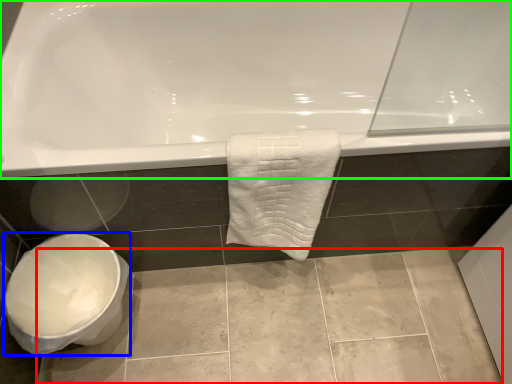
Question: Considering the real-world distances, which object is closest to ceramic tile (highlighted by a red box)? toilet bowl (highlighted by a blue box) or bathtub (highlighted by a green box).

Choices:
 (A) toilet bowl
 (B) bathtub

Answer: (A)